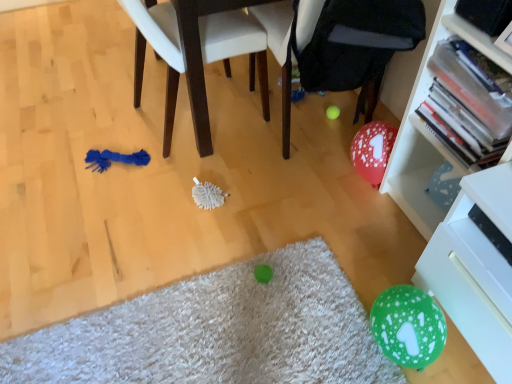
Image resolution: width=512 pixels, height=384 pixels. In order to click on vacant space behind white bristle brush at center in this screenshot , I will do `click(214, 165)`.